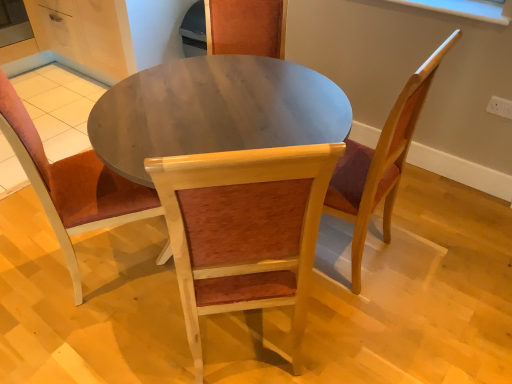
Locate an element on the screen. vacant area situated to the left side of wooden chair at center, the third chair in the right-to-left sequence is located at coordinates (26, 265).